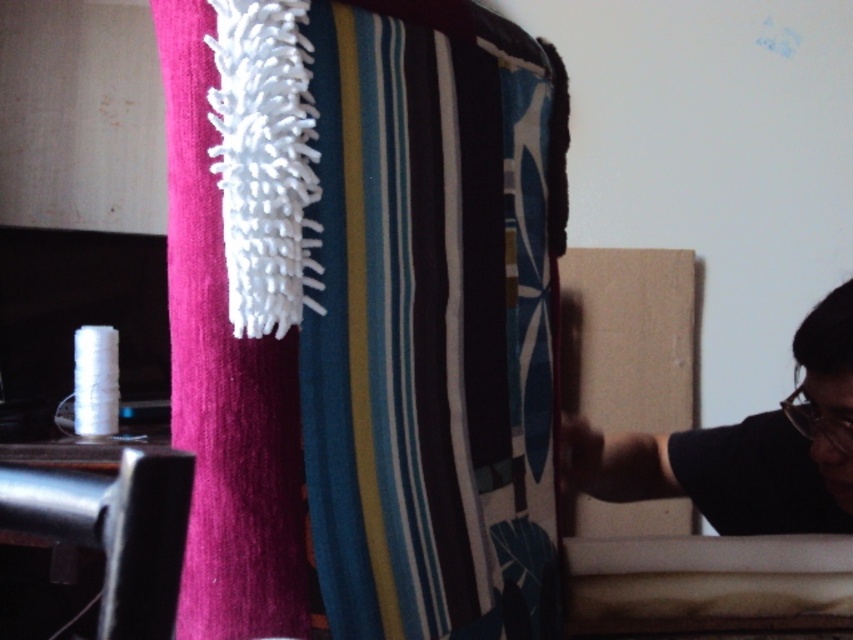
You are hanging a striped fabric at center and a white fuzzy brush at left in a room. If you want to place a decorative item between them, where should you position it?

The striped fabric at center is to the right of the white fuzzy brush at left, so you should place the decorative item between them in the middle area between the two objects.

You are standing in front of the colorful striped fabric. There are two points marked on the fabric at coordinates point [448,340] and point [202,193]. Which point is closer to you?

Point [448,340] is further to the viewer than point [202,193], so point [202,193] is closer to you.